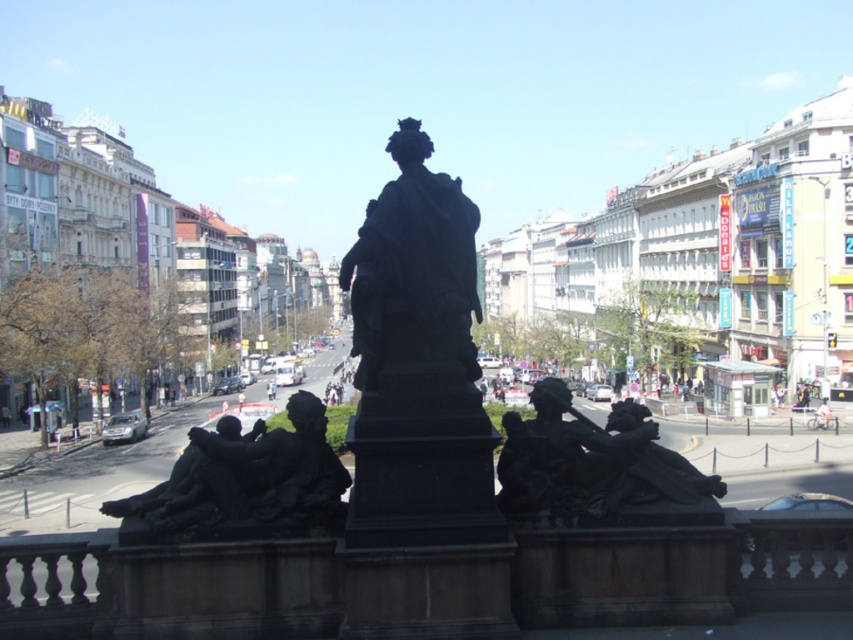
Question: Which object is farther from the camera taking this photo?

Choices:
 (A) light blue fabric person at lower right
 (B) black polished statue at center
 (C) dark brown stone sculpture at lower right
 (D) dark brown stone sculpture at lower center

Answer: (A)

Question: Does dark brown stone sculpture at lower center appear under light blue fabric person at lower right?

Choices:
 (A) no
 (B) yes

Answer: (A)

Question: Which point is closer to the camera?

Choices:
 (A) (471, 211)
 (B) (608, 449)

Answer: (B)

Question: Which point is closer to the camera taking this photo?

Choices:
 (A) (409, 337)
 (B) (828, 419)
 (C) (263, 492)
 (D) (633, 452)

Answer: (A)

Question: Observing the image, what is the correct spatial positioning of dark brown stone sculpture at lower right in reference to dark brown stone sculpture at lower center?

Choices:
 (A) right
 (B) left

Answer: (A)

Question: Is black polished statue at center smaller than light blue fabric person at lower right?

Choices:
 (A) yes
 (B) no

Answer: (B)